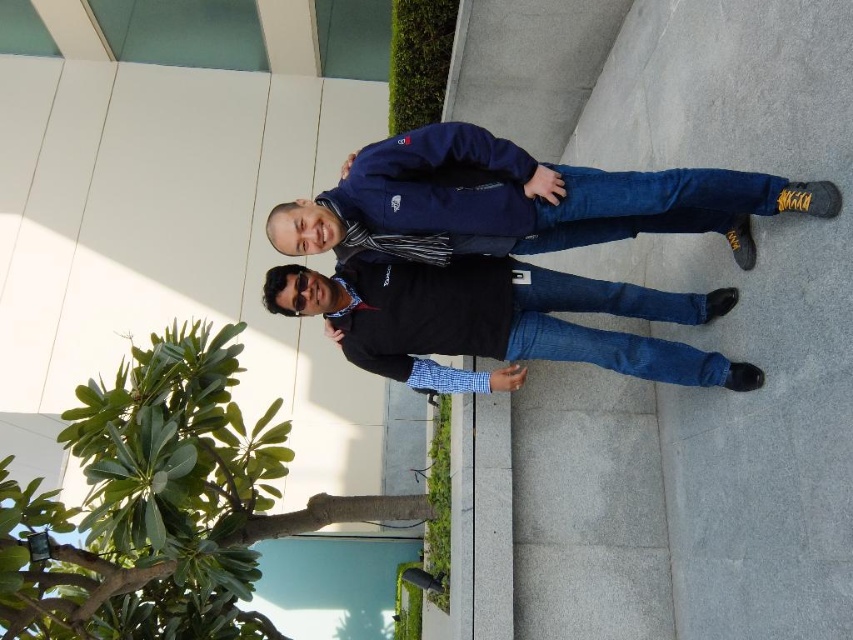
You are standing in front of the modern building and see the navy blue fleece jacket at upper center and the black matte shirt at center. Which one is positioned to the right side?

The navy blue fleece jacket at upper center is positioned to the right of the black matte shirt at center.

You are a photographer standing 10 feet away from the two people in the image. You want to capture a photo that includes both the navy blue fleece jacket at upper center and the black matte shirt at center without any part of them being cut off. What is the minimum required width of your camera lens in inches to ensure both are fully visible?

The minimum required width of the camera lens must be at least 11.83 inches to include both the navy blue fleece jacket at upper center and the black matte shirt at center without any part being cut off.

You are a photographer trying to capture both the navy blue fleece jacket at upper center and the black matte shirt at center in a single shot. Based on their positions, which one will appear closer to the camera in the photo?

The navy blue fleece jacket at upper center will appear closer to the camera because it is positioned in front of the black matte shirt at center.